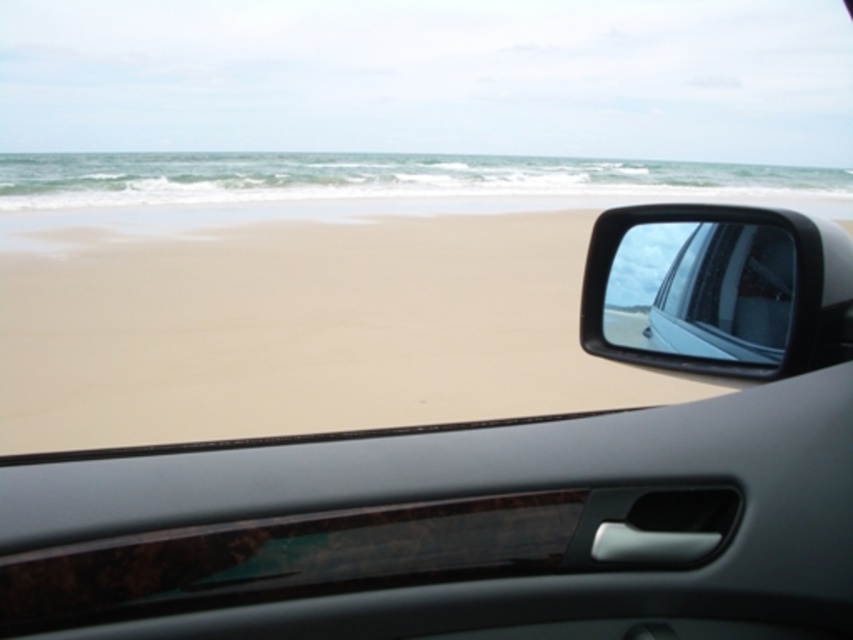
Question: In this image, where is sandy beach at lower left located relative to glossy plastic car mirror at upper right?

Choices:
 (A) below
 (B) above

Answer: (A)

Question: Does sandy beach at lower left appear over glossy plastic car mirror at upper right?

Choices:
 (A) no
 (B) yes

Answer: (A)

Question: Which point is farther to the camera?

Choices:
 (A) pos(532,237)
 (B) pos(650,362)

Answer: (A)

Question: Which point is closer to the camera taking this photo?

Choices:
 (A) (625, 243)
 (B) (572, 240)

Answer: (A)

Question: Is sandy beach at lower left positioned at the back of glossy plastic car mirror at upper right?

Choices:
 (A) yes
 (B) no

Answer: (A)

Question: Which object appears farthest from the camera in this image?

Choices:
 (A) glossy plastic car mirror at upper right
 (B) sandy beach at lower left

Answer: (B)